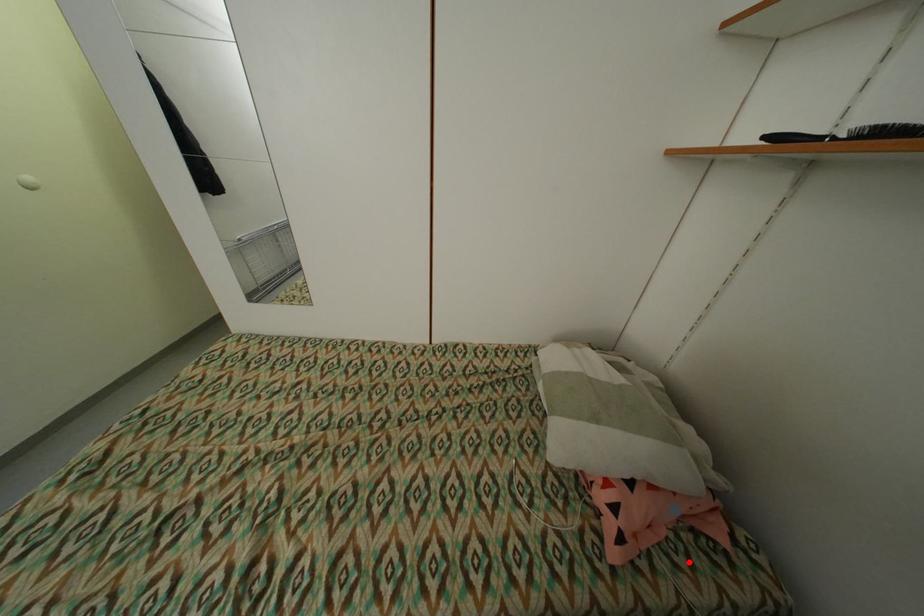
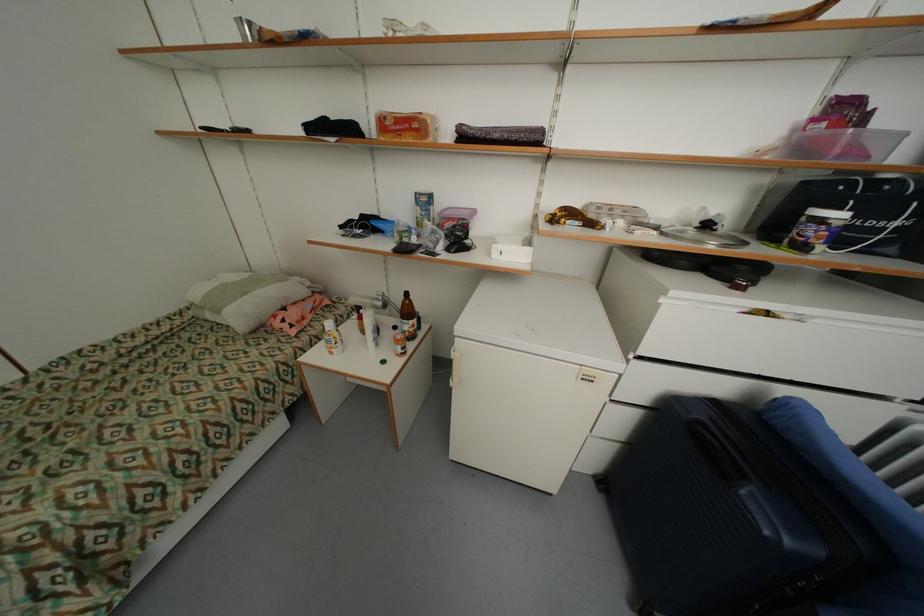
Question: I am providing you with two images of the same scene from different viewpoints. Image1 has a red point marked. In image2, the corresponding 3D location appears at what relative position? Reply with the corresponding letter.

Choices:
 (A) Closer
 (B) Farther

Answer: (B)